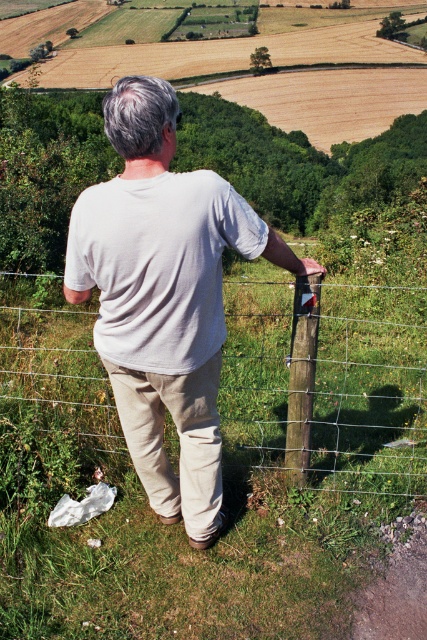
Question: Which of the following is the closest to the observer?

Choices:
 (A) wire mesh fence at center
 (B) white cotton shirt at center

Answer: (B)

Question: Which object appears closest to the camera in this image?

Choices:
 (A) wire mesh fence at center
 (B) white cotton shirt at center

Answer: (B)

Question: Does wire mesh fence at center have a lesser width compared to white cotton shirt at center?

Choices:
 (A) no
 (B) yes

Answer: (B)

Question: Which point is closer to the camera?

Choices:
 (A) (125, 243)
 (B) (295, 291)
 (C) (336, 376)

Answer: (A)

Question: Considering the relative positions of wire mesh fence at center and white cotton shirt at center in the image provided, where is wire mesh fence at center located with respect to white cotton shirt at center?

Choices:
 (A) left
 (B) right

Answer: (B)

Question: Is wire mesh fence at center wider than white cotton shirt at center?

Choices:
 (A) no
 (B) yes

Answer: (A)